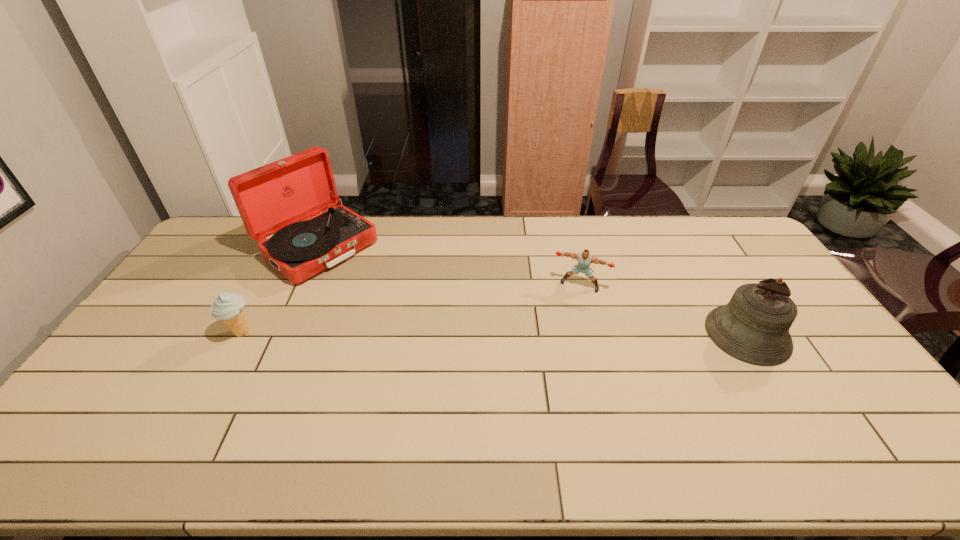
The height and width of the screenshot is (540, 960). I want to click on icecream, so click(229, 307).

Identify the location of the rightmost object. The width and height of the screenshot is (960, 540). pos(753,327).

The height and width of the screenshot is (540, 960). Find the location of `the third shortest object`. the third shortest object is located at coordinates (753, 327).

Find the location of a particular element. This screenshot has width=960, height=540. puncher is located at coordinates (584, 259).

Find the location of a particular element. phonograph_record is located at coordinates (273, 200).

Where is `free location located on the back of the icecream`? Image resolution: width=960 pixels, height=540 pixels. free location located on the back of the icecream is located at coordinates (255, 307).

Find the location of `free space located on the front of the rightmost object`. free space located on the front of the rightmost object is located at coordinates (778, 385).

I want to click on vacant space located 0.240m on the front-facing side of the puncher, so click(554, 346).

Locate an element on the screen. This screenshot has width=960, height=540. vacant space located on the front-facing side of the puncher is located at coordinates (550, 359).

The width and height of the screenshot is (960, 540). What are the coordinates of `vacant space located on the front-facing side of the puncher` in the screenshot? It's located at (549, 361).